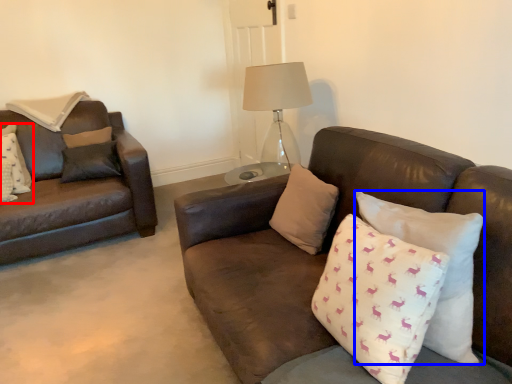
Question: Which of the following is the farthest to the observer, pillow (highlighted by a red box) or pillow (highlighted by a blue box)?

Choices:
 (A) pillow
 (B) pillow

Answer: (A)